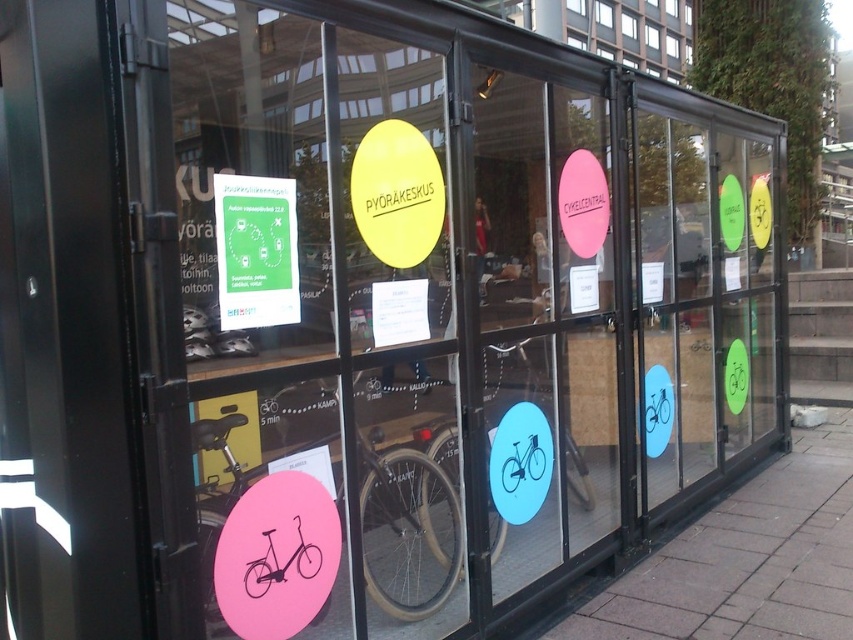
Which is below, pink matte sign at center or pink matte bicycle at lower left?

Positioned lower is pink matte bicycle at lower left.

Which of these two, pink matte sign at center or pink matte bicycle at lower left, stands shorter?

With less height is pink matte bicycle at lower left.

Is point (486, 404) in front of point (241, 420)?

No, (486, 404) is further to viewer.

Locate an element on the screen. Image resolution: width=853 pixels, height=640 pixels. pink matte sign at center is located at coordinates (544, 316).

Is green matte bicycle at right closer to camera compared to pink matte bicycle at lower left?

That is False.

Between green matte bicycle at right and pink matte bicycle at lower left, which one appears on the left side from the viewer's perspective?

From the viewer's perspective, pink matte bicycle at lower left appears more on the left side.

Does point (679, 378) come closer to viewer compared to point (416, 454)?

No, (679, 378) is further to viewer.

Identify the location of green matte bicycle at right. (703, 294).

Who is higher up, pink matte sign at center or clear glass window at upper center?

clear glass window at upper center is higher up.

Which of these two, pink matte sign at center or clear glass window at upper center, stands shorter?

With less height is clear glass window at upper center.

Is point (544, 392) positioned before point (682, 22)?

Yes.

At what (x,y) coordinates should I click in order to perform the action: click on pink matte sign at center. Please return your answer as a coordinate pair (x, y). The image size is (853, 640). Looking at the image, I should click on (544, 316).